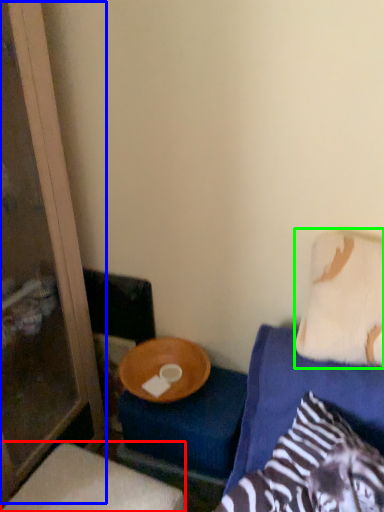
Question: Estimate the real-world distances between objects in this image. Which object is closer to furniture (highlighted by a red box), screen door (highlighted by a blue box) or pillow (highlighted by a green box)?

Choices:
 (A) screen door
 (B) pillow

Answer: (A)